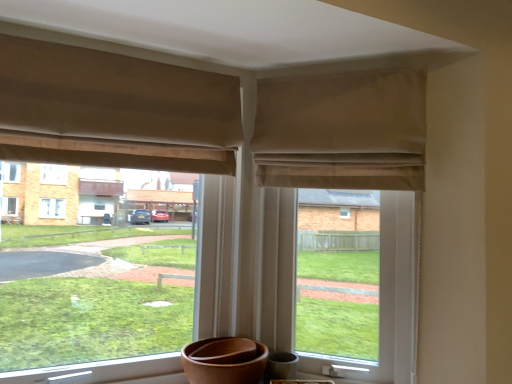
Question: Relative to beige fabric curtain at upper center, which is counted as the first curtain, starting from the right, is beige fabric at upper center in front or behind?

Choices:
 (A) front
 (B) behind

Answer: (B)

Question: From a real-world perspective, relative to beige fabric curtain at upper center, which is the 2th curtain in left-to-right order, is beige fabric at upper center vertically above or below?

Choices:
 (A) above
 (B) below

Answer: (B)

Question: Considering the real-world distances, which object is closest to the beige fabric curtain at upper left, which appears as the 1th curtain when viewed from the left?

Choices:
 (A) beige fabric curtain at upper center, which is counted as the first curtain, starting from the right
 (B) beige fabric at upper center
 (C) beige fabric window at center

Answer: (A)

Question: Estimate the real-world distances between objects in this image. Which object is closer to the beige fabric curtain at upper left, the second curtain in the right-to-left sequence?

Choices:
 (A) beige fabric window at center
 (B) beige fabric at upper center
 (C) beige fabric curtain at upper center, which is the 2th curtain in left-to-right order

Answer: (C)